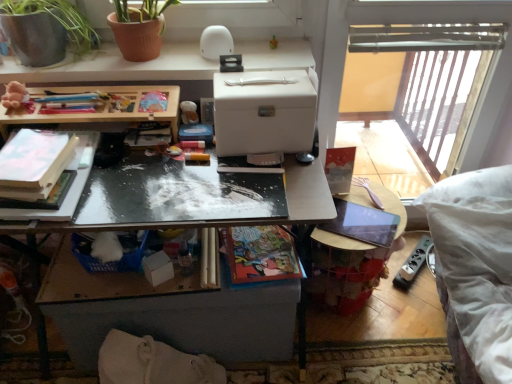
Locate an element on the screen. free area below terracotta clay pot at upper left (from a real-world perspective) is located at coordinates (67, 58).